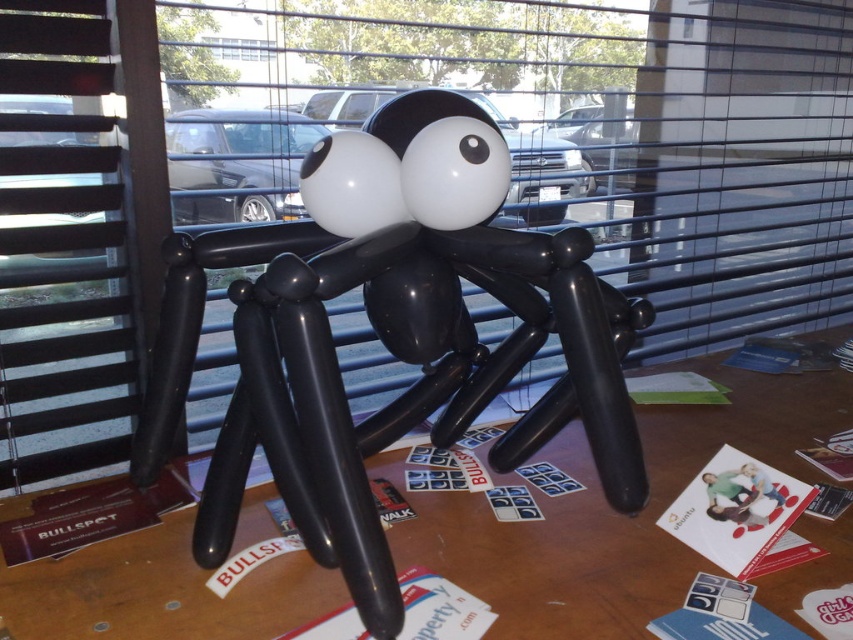
Does black rubber balloon spider at center appear over black matte balloon spider at center?

Indeed, black rubber balloon spider at center is positioned over black matte balloon spider at center.

In the scene shown: Can you confirm if black rubber balloon spider at center is shorter than black matte balloon spider at center?

No, black rubber balloon spider at center is not shorter than black matte balloon spider at center.

Does point (544, 394) come in front of point (795, 426)?

Yes, it is in front of point (795, 426).

The width and height of the screenshot is (853, 640). In order to click on black rubber balloon spider at center in this screenshot , I will do 387,337.